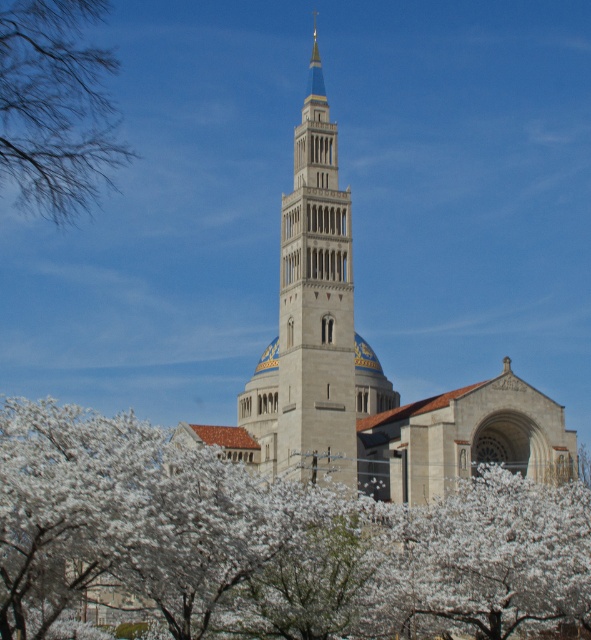
Question: Which object is farther from the camera taking this photo?

Choices:
 (A) beige stone bell tower at center
 (B) white blossoms at center
 (C) bare branches at upper left
 (D) beige stone church at center

Answer: (A)

Question: Which of the following is the closest to the observer?

Choices:
 (A) beige stone church at center
 (B) white blossoms at center
 (C) beige stone bell tower at center

Answer: (B)

Question: Can you confirm if white blossoms at center is smaller than beige stone bell tower at center?

Choices:
 (A) yes
 (B) no

Answer: (A)

Question: Is white blossoms at center wider than bare branches at upper left?

Choices:
 (A) no
 (B) yes

Answer: (B)

Question: Which object is farther from the camera taking this photo?

Choices:
 (A) bare branches at upper left
 (B) white blossoms at center
 (C) beige stone bell tower at center
 (D) beige stone church at center

Answer: (C)

Question: Is beige stone bell tower at center to the right of bare branches at upper left from the viewer's perspective?

Choices:
 (A) yes
 (B) no

Answer: (A)